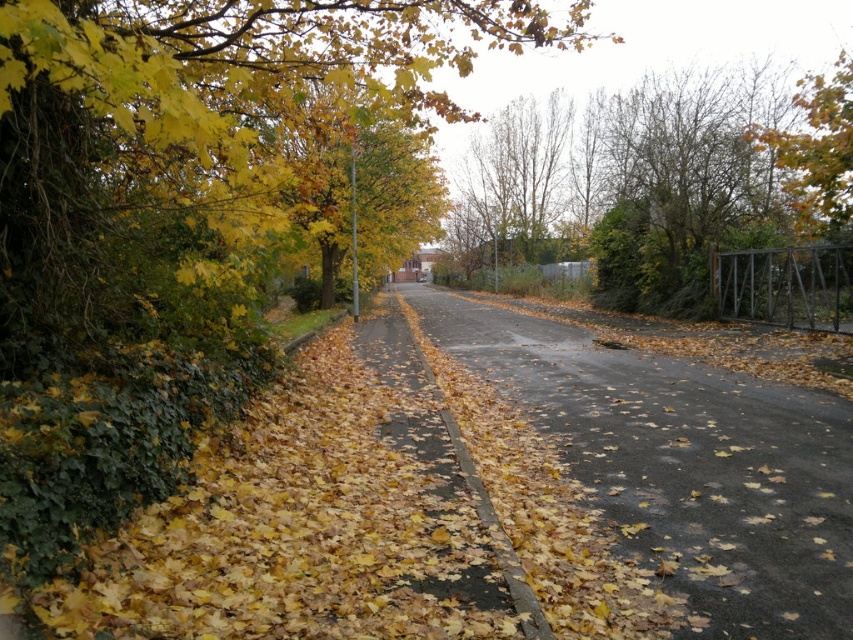
Measure the distance between green leafy tree at left and camera.

The distance of green leafy tree at left from camera is 2.91 meters.

Is green leafy tree at left above brown asphalt road at center?

Yes.

This screenshot has width=853, height=640. What do you see at coordinates (192, 134) in the screenshot?
I see `green leafy tree at left` at bounding box center [192, 134].

I want to click on green leafy tree at left, so [192, 134].

Between brown asphalt road at center and green leafy tree at upper right, which one appears on the right side from the viewer's perspective?

green leafy tree at upper right

Between brown asphalt road at center and green leafy tree at upper right, which one is positioned higher?

green leafy tree at upper right

Describe the element at coordinates (683, 465) in the screenshot. I see `brown asphalt road at center` at that location.

At what (x,y) coordinates should I click in order to perform the action: click on brown asphalt road at center. Please return your answer as a coordinate pair (x, y). Looking at the image, I should click on (683, 465).

Which is more to the left, green leafy tree at left or green leafy tree at upper right?

Positioned to the left is green leafy tree at left.

Can you confirm if green leafy tree at left is thinner than green leafy tree at upper right?

Yes.

Does point (194, 99) come farther from viewer compared to point (756, 176)?

No, it is in front of (756, 176).

The height and width of the screenshot is (640, 853). Find the location of `green leafy tree at left`. green leafy tree at left is located at coordinates (192, 134).